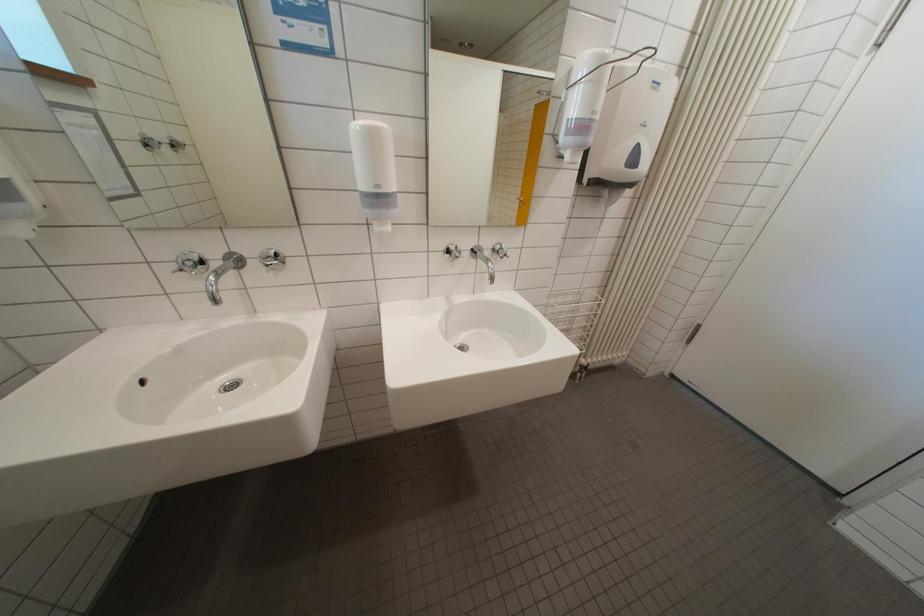
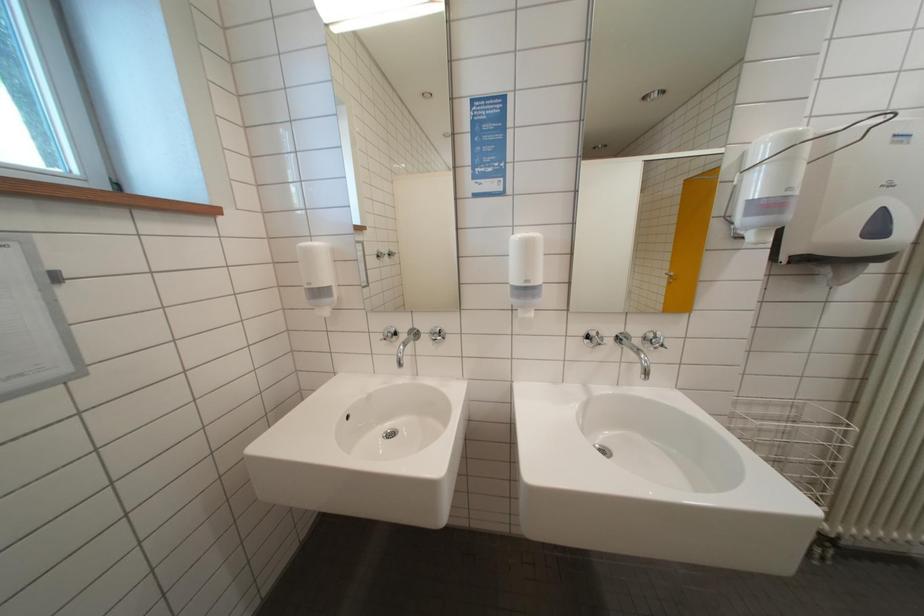
Based on the continuous images, in which direction is the camera rotating?

The rotation direction of the camera is left-up.